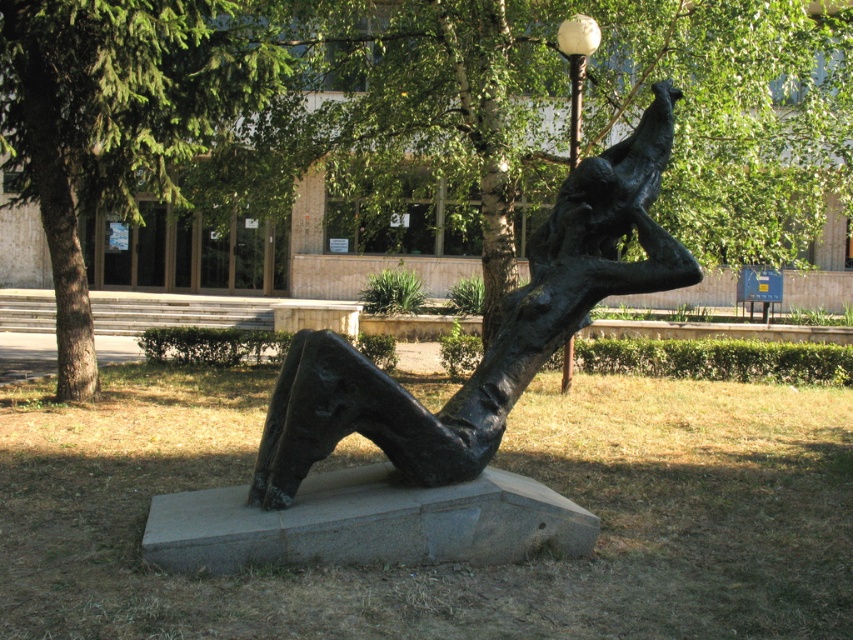
You are an artist planning to install a new sculpture in the park. You have a limited budget and need to know which object, the green leafy tree at upper left or the white glass ball at upper center, requires more space vertically to accommodate your design. Based on the scene, which one should you consider?

The green leafy tree at upper left requires more vertical space because it is taller than the white glass ball at upper center.

You are standing in the park and want to take a photo of the sculpture without any obstructions. The green leafy tree at upper center is located at coordinates point 0.227, 0.586. Where should you position yourself to ensure the tree doesn not block the sculpture in your view?

To avoid the green leafy tree at upper center blocking the sculpture, position yourself such that the tree is outside the frame. Since the tree is at point (498,145), moving to the opposite side of the sculpture from the tree would keep it out of view.